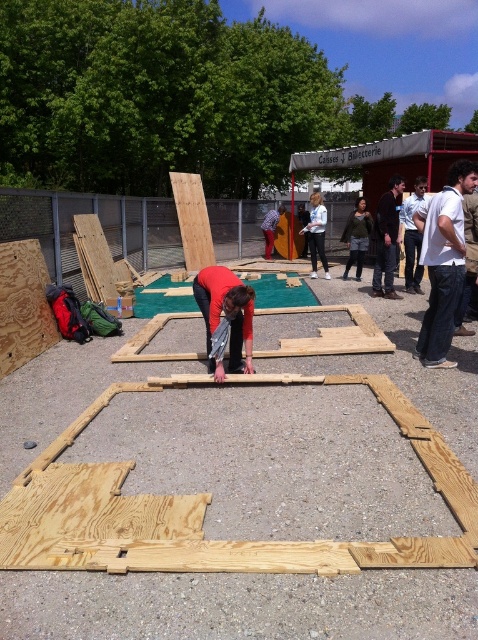
Consider the image. Which is more to the right, plywood at left or light blue shirt at center?

Positioned to the right is light blue shirt at center.

Which is below, plywood at left or light blue shirt at center?

plywood at left is lower down.

Who is more forward, (43, 289) or (413, 260)?

Positioned in front is point (43, 289).

Identify the location of plywood at left. (23, 305).

Does plywood at left appear over denim jacket at center?

Incorrect, plywood at left is not positioned above denim jacket at center.

What do you see at coordinates (23, 305) in the screenshot?
I see `plywood at left` at bounding box center [23, 305].

Does point (17, 298) come in front of point (360, 253)?

Yes, point (17, 298) is in front of point (360, 253).

Locate an element on the screen. This screenshot has height=640, width=478. plywood at left is located at coordinates (23, 305).

At what (x,y) coordinates should I click in order to perform the action: click on white cotton shirt at center. Please return your answer as a coordinate pair (x, y). Looking at the image, I should click on (443, 260).

Which of these two, white cotton shirt at center or black cotton shirt at center, stands shorter?

white cotton shirt at center

This screenshot has width=478, height=640. Describe the element at coordinates (443, 260) in the screenshot. I see `white cotton shirt at center` at that location.

Identify the location of white cotton shirt at center. (443, 260).